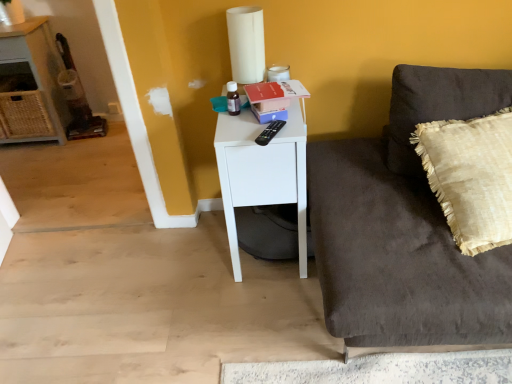
Question: Can you confirm if beige textured pillow at right is shorter than white matte side table at center?

Choices:
 (A) no
 (B) yes

Answer: (A)

Question: Can you confirm if beige textured pillow at right is wider than white matte side table at center?

Choices:
 (A) yes
 (B) no

Answer: (B)

Question: Can you see beige textured pillow at right touching white matte side table at center?

Choices:
 (A) yes
 (B) no

Answer: (B)

Question: Is beige textured pillow at right positioned before white matte side table at center?

Choices:
 (A) yes
 (B) no

Answer: (A)

Question: From the image's perspective, is beige textured pillow at right under white matte side table at center?

Choices:
 (A) no
 (B) yes

Answer: (A)

Question: Would you say white matte side table at center is to the left or to the right of dark brown velvety couch at right in the picture?

Choices:
 (A) right
 (B) left

Answer: (B)

Question: Does point (220, 119) appear closer or farther from the camera than point (373, 160)?

Choices:
 (A) farther
 (B) closer

Answer: (B)

Question: In terms of width, does white matte side table at center look wider or thinner when compared to dark brown velvety couch at right?

Choices:
 (A) wide
 (B) thin

Answer: (B)

Question: From a real-world perspective, is white matte side table at center above or below dark brown velvety couch at right?

Choices:
 (A) above
 (B) below

Answer: (B)

Question: In the image, is white matte side table at center positioned in front of or behind woven wicker cabinet at left?

Choices:
 (A) front
 (B) behind

Answer: (A)

Question: From a real-world perspective, is white matte side table at center positioned above or below woven wicker cabinet at left?

Choices:
 (A) below
 (B) above

Answer: (A)

Question: Is point (288, 147) closer or farther from the camera than point (34, 41)?

Choices:
 (A) closer
 (B) farther

Answer: (A)

Question: From their relative heights in the image, would you say white matte side table at center is taller or shorter than woven wicker cabinet at left?

Choices:
 (A) tall
 (B) short

Answer: (B)

Question: Based on their positions, is woven wicker cabinet at left located to the left or right of dark brown velvety couch at right?

Choices:
 (A) left
 (B) right

Answer: (A)

Question: Looking at their shapes, would you say woven wicker cabinet at left is wider or thinner than dark brown velvety couch at right?

Choices:
 (A) thin
 (B) wide

Answer: (A)